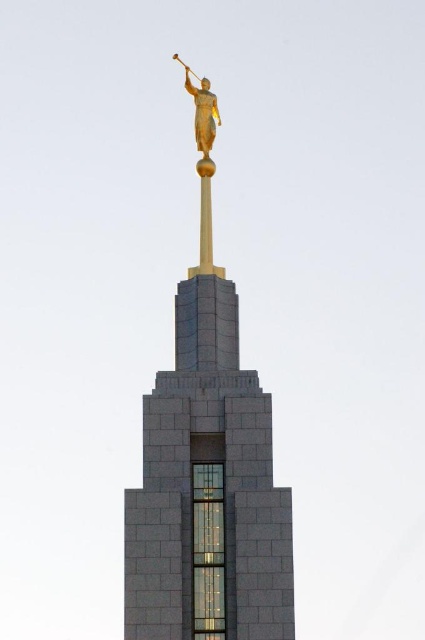
Between point (201, 589) and point (198, 93), which one is positioned in front?

Point (201, 589)

Does point (210, 470) lie in front of point (195, 90)?

That is True.

Where is `gold polished statue at upper center`? This screenshot has width=425, height=640. gold polished statue at upper center is located at coordinates (206, 467).